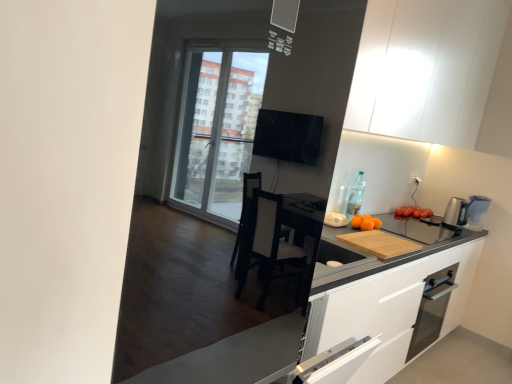
Question: From the image's perspective, is orange matte at right under glass door oven at lower right?

Choices:
 (A) yes
 (B) no

Answer: (B)

Question: Does orange matte at right turn towards glass door oven at lower right?

Choices:
 (A) no
 (B) yes

Answer: (A)

Question: Considering the relative sizes of orange matte at right and glass door oven at lower right in the image provided, is orange matte at right bigger than glass door oven at lower right?

Choices:
 (A) no
 (B) yes

Answer: (A)

Question: Are orange matte at right and glass door oven at lower right making contact?

Choices:
 (A) no
 (B) yes

Answer: (A)

Question: Is orange matte at right surrounding glass door oven at lower right?

Choices:
 (A) yes
 (B) no

Answer: (B)

Question: From the image's perspective, is wooden cutting board at right above or below clear glass bottle at upper right?

Choices:
 (A) above
 (B) below

Answer: (B)

Question: From a real-world perspective, relative to clear glass bottle at upper right, is wooden cutting board at right vertically above or below?

Choices:
 (A) below
 (B) above

Answer: (A)

Question: Is wooden cutting board at right situated inside clear glass bottle at upper right or outside?

Choices:
 (A) inside
 (B) outside

Answer: (B)

Question: Considering the positions of wooden cutting board at right and clear glass bottle at upper right in the image, is wooden cutting board at right wider or thinner than clear glass bottle at upper right?

Choices:
 (A) wide
 (B) thin

Answer: (A)

Question: Based on their positions, is silver metallic coffee machine at right located to the left or right of white matte cabinet at upper center?

Choices:
 (A) left
 (B) right

Answer: (B)

Question: Considering their positions, is silver metallic coffee machine at right located in front of or behind white matte cabinet at upper center?

Choices:
 (A) behind
 (B) front

Answer: (A)

Question: Considering the positions of silver metallic coffee machine at right and white matte cabinet at upper center in the image, is silver metallic coffee machine at right taller or shorter than white matte cabinet at upper center?

Choices:
 (A) tall
 (B) short

Answer: (B)

Question: From the image's perspective, is silver metallic coffee machine at right above or below white matte cabinet at upper center?

Choices:
 (A) below
 (B) above

Answer: (A)

Question: From the image's perspective, is white matte cabinet at upper center located above or below orange matte at right?

Choices:
 (A) below
 (B) above

Answer: (B)

Question: Visually, is white matte cabinet at upper center positioned to the left or to the right of orange matte at right?

Choices:
 (A) right
 (B) left

Answer: (A)